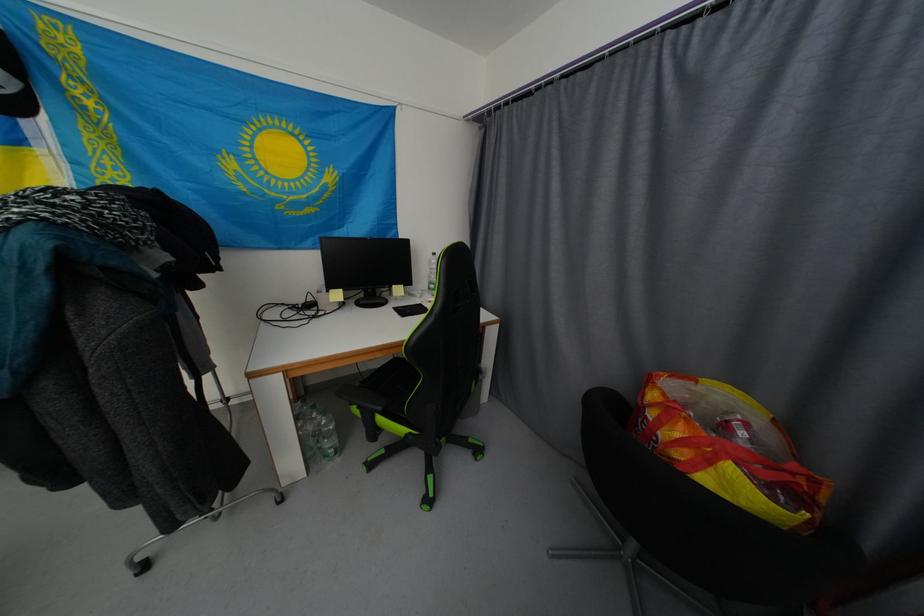
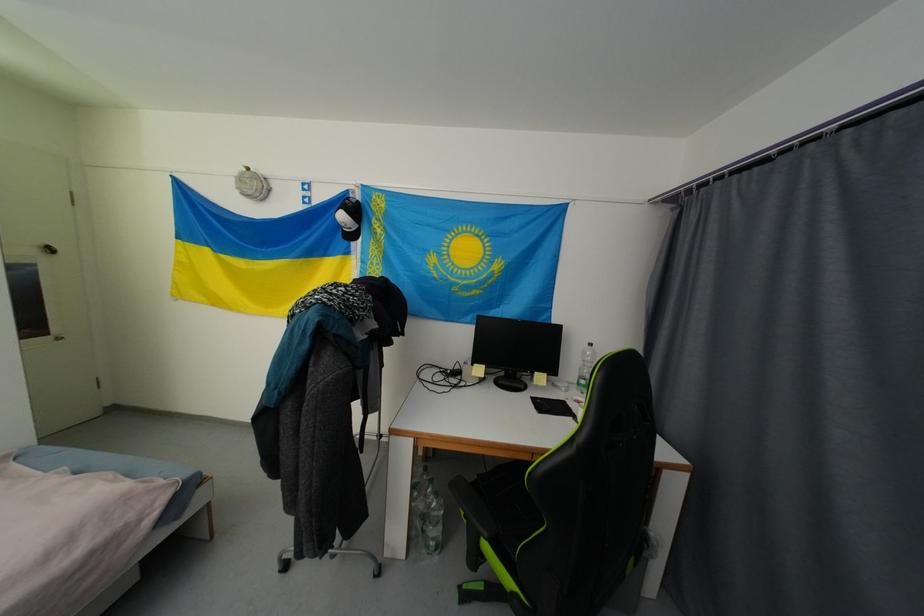
Find the pixel in the second image that matches (384,410) in the first image.

(492, 536)